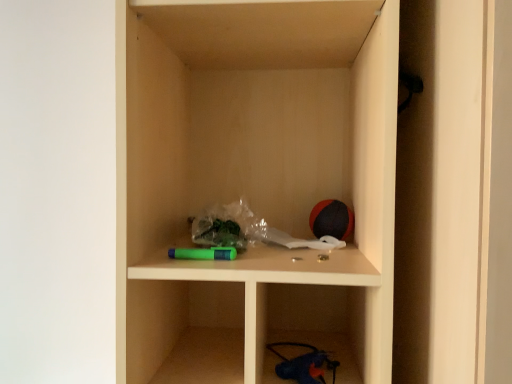
Measure the distance between rubberized red and black ball at upper right and camera.

82.80 centimeters.

Describe the element at coordinates (331, 219) in the screenshot. I see `rubberized red and black ball at upper right` at that location.

Locate an element on the screen. rubberized red and black ball at upper right is located at coordinates (331, 219).

What do you see at coordinates (263, 133) in the screenshot? I see `matte plastic cabinet at center` at bounding box center [263, 133].

Measure the distance between matte plastic cabinet at center and camera.

matte plastic cabinet at center is 22.77 inches from camera.

Measure the distance between point (136,90) and camera.

A distance of 25.87 inches exists between point (136,90) and camera.

Identify the location of matte plastic cabinet at center. (263, 133).

What are the coordinates of `rubberized red and black ball at upper right` in the screenshot? It's located at (331, 219).

Is matte plastic cabinet at center to the left of rubberized red and black ball at upper right from the viewer's perspective?

Yes, matte plastic cabinet at center is to the left of rubberized red and black ball at upper right.

Considering the positions of objects matte plastic cabinet at center and rubberized red and black ball at upper right in the image provided, who is behind, matte plastic cabinet at center or rubberized red and black ball at upper right?

rubberized red and black ball at upper right is further from the camera.

Which point is more forward, (333, 69) or (334, 207)?

Point (334, 207)

Based on the photo, from the image's perspective, is matte plastic cabinet at center above or below rubberized red and black ball at upper right?

matte plastic cabinet at center is above rubberized red and black ball at upper right.

From a real-world perspective, is matte plastic cabinet at center beneath rubberized red and black ball at upper right?

No, from a real-world perspective, matte plastic cabinet at center is not below rubberized red and black ball at upper right.

Which object is wider, matte plastic cabinet at center or rubberized red and black ball at upper right?

matte plastic cabinet at center is wider.

Considering the relative sizes of matte plastic cabinet at center and rubberized red and black ball at upper right in the image provided, is matte plastic cabinet at center taller than rubberized red and black ball at upper right?

Yes.

Does matte plastic cabinet at center have a smaller size compared to rubberized red and black ball at upper right?

Actually, matte plastic cabinet at center might be larger than rubberized red and black ball at upper right.

Is matte plastic cabinet at center not within rubberized red and black ball at upper right?

Yes.

Is matte plastic cabinet at center far from rubberized red and black ball at upper right?

No, matte plastic cabinet at center is in close proximity to rubberized red and black ball at upper right.

Is matte plastic cabinet at center facing away from rubberized red and black ball at upper right?

Yes.

What's the angular difference between matte plastic cabinet at center and rubberized red and black ball at upper right's facing directions?

0.0284 degrees.

I want to click on toy behind the matte plastic cabinet at center, so click(x=331, y=219).

Between rubberized red and black ball at upper right and matte plastic cabinet at center, which one appears on the left side from the viewer's perspective?

Positioned to the left is matte plastic cabinet at center.

Considering the positions of objects rubberized red and black ball at upper right and matte plastic cabinet at center in the image provided, who is in front, rubberized red and black ball at upper right or matte plastic cabinet at center?

matte plastic cabinet at center.

Which point is more distant from viewer, (352, 218) or (207, 176)?

The point (207, 176) is more distant.

From the image's perspective, which one is positioned higher, rubberized red and black ball at upper right or matte plastic cabinet at center?

matte plastic cabinet at center.

From a real-world perspective, which is physically above, rubberized red and black ball at upper right or matte plastic cabinet at center?

matte plastic cabinet at center.

Which of these two, rubberized red and black ball at upper right or matte plastic cabinet at center, is wider?

matte plastic cabinet at center is wider.

In the scene shown: Can you confirm if rubberized red and black ball at upper right is shorter than matte plastic cabinet at center?

Correct, rubberized red and black ball at upper right is not as tall as matte plastic cabinet at center.

Is rubberized red and black ball at upper right bigger than matte plastic cabinet at center?

Actually, rubberized red and black ball at upper right might be smaller than matte plastic cabinet at center.

Is rubberized red and black ball at upper right situated inside matte plastic cabinet at center or outside?

rubberized red and black ball at upper right is spatially positioned inside matte plastic cabinet at center.

Is rubberized red and black ball at upper right next to matte plastic cabinet at center?

rubberized red and black ball at upper right is not next to matte plastic cabinet at center, and they're not touching.

Could you tell me if rubberized red and black ball at upper right is facing matte plastic cabinet at center?

Yes, rubberized red and black ball at upper right faces towards matte plastic cabinet at center.

What are the coordinates of `toy that is behind the matte plastic cabinet at center` in the screenshot? It's located at (331, 219).

I want to click on toy below the matte plastic cabinet at center (from the image's perspective), so click(331, 219).

The height and width of the screenshot is (384, 512). What are the coordinates of `cabinet in front of the rubberized red and black ball at upper right` in the screenshot? It's located at (263, 133).